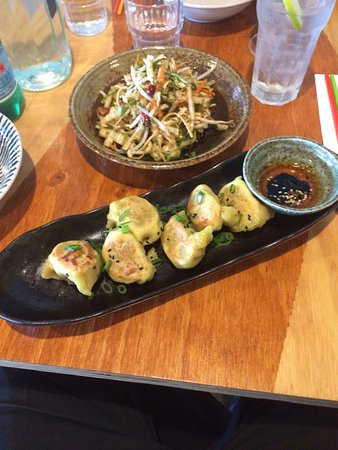
The height and width of the screenshot is (450, 338). What are the coordinates of `empty clear bottle sitting on table` in the screenshot? It's located at (36, 40).